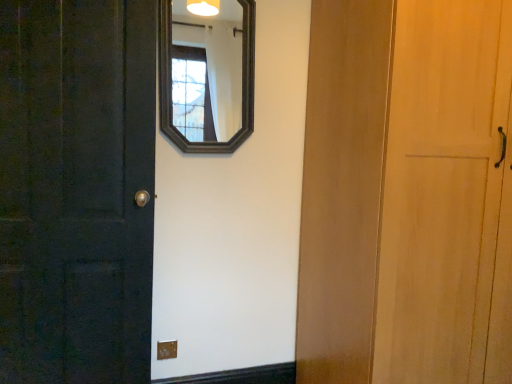
Image resolution: width=512 pixels, height=384 pixels. In order to click on dark wood mirror at upper center in this screenshot , I will do `click(207, 72)`.

Find the location of a particular element. This screenshot has width=512, height=384. door in front of the matte brown outlet at lower center is located at coordinates (76, 190).

In the scene shown: Which of these two, matte brown outlet at lower center or matte black door at left, is smaller?

Smaller between the two is matte brown outlet at lower center.

In the scene shown: Can you see matte brown outlet at lower center touching matte black door at left?

No, matte brown outlet at lower center is not in contact with matte black door at left.

Based on the photo, considering the positions of objects matte black door at left and dark wood mirror at upper center in the image provided, who is more to the right, matte black door at left or dark wood mirror at upper center?

From the viewer's perspective, dark wood mirror at upper center appears more on the right side.

Which of these two, matte black door at left or dark wood mirror at upper center, is thinner?

dark wood mirror at upper center.

From the image's perspective, is matte black door at left below dark wood mirror at upper center?

Yes.

Considering the sizes of objects matte black door at left and dark wood mirror at upper center in the image provided, who is smaller, matte black door at left or dark wood mirror at upper center?

dark wood mirror at upper center is smaller.

Can you confirm if dark wood mirror at upper center is positioned to the right of matte black door at left?

Indeed, dark wood mirror at upper center is positioned on the right side of matte black door at left.

Can we say dark wood mirror at upper center lies outside matte black door at left?

That's correct, dark wood mirror at upper center is outside of matte black door at left.

Which point is more forward, [224,70] or [20,285]?

The point [20,285] is closer.

From a real-world perspective, which is physically above, dark wood mirror at upper center or matte black door at left?

dark wood mirror at upper center, from a real-world perspective.

From the image's perspective, which is below, dark wood mirror at upper center or matte brown outlet at lower center?

matte brown outlet at lower center is shown below in the image.

Is dark wood mirror at upper center turned away from matte brown outlet at lower center?

No, matte brown outlet at lower center is not at the back of dark wood mirror at upper center.

Considering the relative sizes of dark wood mirror at upper center and matte brown outlet at lower center in the image provided, is dark wood mirror at upper center bigger than matte brown outlet at lower center?

Yes.

How far apart are matte black door at left and matte brown outlet at lower center?

A distance of 28.76 inches exists between matte black door at left and matte brown outlet at lower center.

Is matte black door at left next to matte brown outlet at lower center and touching it?

matte black door at left and matte brown outlet at lower center are not in contact.

Which object is closer to the camera, matte black door at left or matte brown outlet at lower center?

matte black door at left is closer to the camera.

Who is smaller, matte black door at left or matte brown outlet at lower center?

matte brown outlet at lower center.

Is matte brown outlet at lower center completely or partially outside of dark wood mirror at upper center?

Yes.

Which of these two, matte brown outlet at lower center or dark wood mirror at upper center, stands shorter?

With less height is matte brown outlet at lower center.

From the image's perspective, is matte brown outlet at lower center over dark wood mirror at upper center?

Actually, matte brown outlet at lower center appears below dark wood mirror at upper center in the image.

Is point (170, 341) positioned behind point (187, 12)?

That is False.

Find the location of a particular element. The width and height of the screenshot is (512, 384). door on the left side of matte brown outlet at lower center is located at coordinates (76, 190).

Find the location of `mirror above the matte black door at left (from a real-world perspective)`. mirror above the matte black door at left (from a real-world perspective) is located at coordinates (207, 72).

Considering their positions, is matte black door at left positioned further to matte brown outlet at lower center than dark wood mirror at upper center?

dark wood mirror at upper center.

When comparing their distances from matte brown outlet at lower center, does dark wood mirror at upper center or matte black door at left seem further?

Based on the image, dark wood mirror at upper center appears to be further to matte brown outlet at lower center.

From the image, which object appears to be nearer to matte black door at left, dark wood mirror at upper center or matte brown outlet at lower center?

matte brown outlet at lower center is closer to matte black door at left.

Based on their spatial positions, is matte brown outlet at lower center or dark wood mirror at upper center further from matte black door at left?

The object further to matte black door at left is dark wood mirror at upper center.

When comparing their distances from dark wood mirror at upper center, does matte brown outlet at lower center or matte black door at left seem closer?

Based on the image, matte black door at left appears to be nearer to dark wood mirror at upper center.

Based on their spatial positions, is matte black door at left or matte brown outlet at lower center closer to dark wood mirror at upper center?

matte black door at left.

I want to click on door that lies between dark wood mirror at upper center and matte brown outlet at lower center from top to bottom, so click(76, 190).